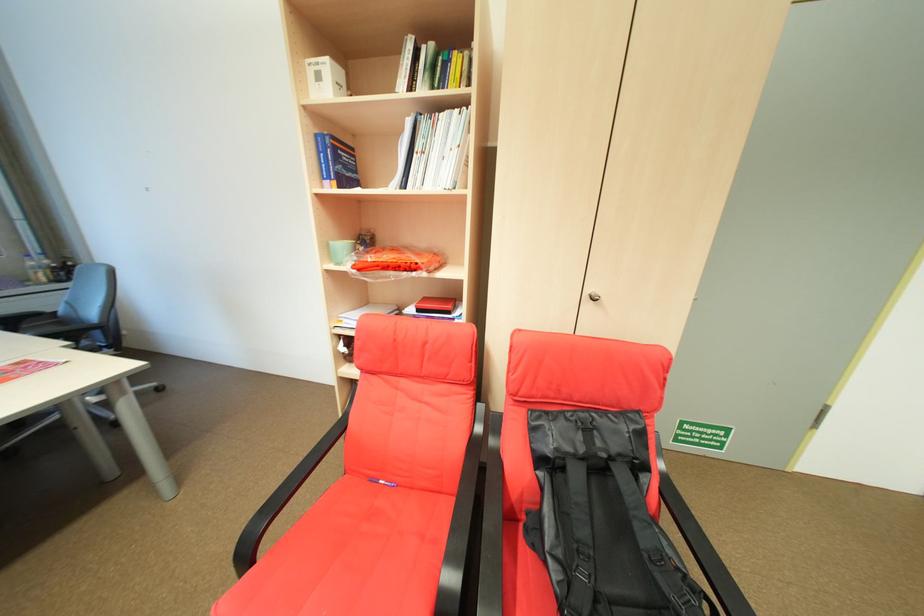
Locate an element on the screen. This screenshot has width=924, height=616. black backpack is located at coordinates (590, 509).